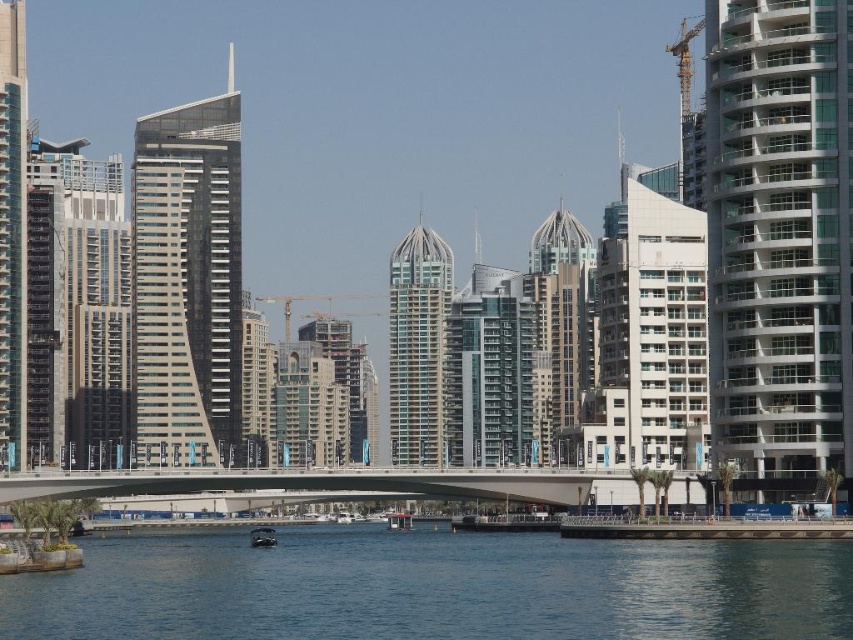
Question: Is white glass building at right positioned at the back of glassy steel skyscraper at center?

Choices:
 (A) no
 (B) yes

Answer: (A)

Question: Among these objects, which one is nearest to the camera?

Choices:
 (A) metallic silver boat at lower center
 (B) concrete bridge at center
 (C) blue water at lower center

Answer: (C)

Question: Which of the following is the closest to the observer?

Choices:
 (A) metallic construction crane at center
 (B) sleek glass skyscraper at center
 (C) concrete bridge at center

Answer: (C)

Question: Is blue water at lower center positioned in front of concrete bridge at center?

Choices:
 (A) no
 (B) yes

Answer: (B)

Question: Is concrete bridge at center above sleek glass skyscraper at center?

Choices:
 (A) yes
 (B) no

Answer: (B)

Question: Which point appears farthest from the camera in this image?

Choices:
 (A) (677, 36)
 (B) (25, 125)

Answer: (A)